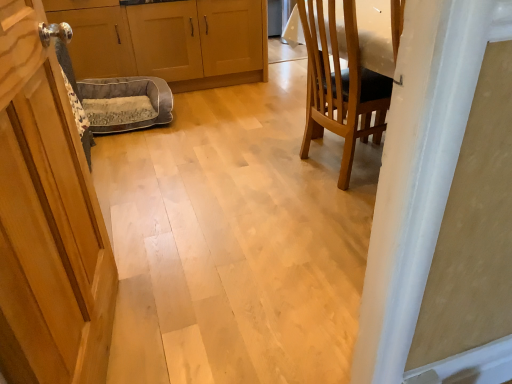
Question: Is gray fabric dog bed at center taller than wooden cabinet at left, the first cabinetry when ordered from left to right?

Choices:
 (A) no
 (B) yes

Answer: (A)

Question: Considering the relative sizes of gray fabric dog bed at center and wooden cabinet at left, the first cabinetry when ordered from left to right, in the image provided, is gray fabric dog bed at center smaller than wooden cabinet at left, the first cabinetry when ordered from left to right,?

Choices:
 (A) no
 (B) yes

Answer: (B)

Question: Considering the relative sizes of gray fabric dog bed at center and wooden cabinet at left, the first cabinetry when ordered from left to right, in the image provided, is gray fabric dog bed at center wider than wooden cabinet at left, the first cabinetry when ordered from left to right,?

Choices:
 (A) no
 (B) yes

Answer: (A)

Question: Is gray fabric dog bed at center shorter than wooden cabinet at left, which appears as the second cabinetry when viewed from the right?

Choices:
 (A) yes
 (B) no

Answer: (A)

Question: Is gray fabric dog bed at center thinner than wooden cabinet at left, which appears as the second cabinetry when viewed from the right?

Choices:
 (A) no
 (B) yes

Answer: (B)

Question: In the image, is gray fabric dog bed at center positioned in front of or behind wooden chair at right?

Choices:
 (A) behind
 (B) front

Answer: (A)

Question: Does point (124, 104) appear closer or farther from the camera than point (322, 115)?

Choices:
 (A) farther
 (B) closer

Answer: (A)

Question: Considering the positions of gray fabric dog bed at center and wooden chair at right in the image, is gray fabric dog bed at center wider or thinner than wooden chair at right?

Choices:
 (A) wide
 (B) thin

Answer: (B)

Question: From a real-world perspective, relative to wooden chair at right, is gray fabric dog bed at center vertically above or below?

Choices:
 (A) below
 (B) above

Answer: (A)

Question: From a real-world perspective, is matte wood cabinets at center, acting as the 2th cabinetry starting from the left, above or below gray fabric dog bed at center?

Choices:
 (A) above
 (B) below

Answer: (A)

Question: From the image's perspective, is matte wood cabinets at center, positioned as the first cabinetry in right-to-left order, positioned above or below gray fabric dog bed at center?

Choices:
 (A) below
 (B) above

Answer: (B)

Question: Considering the positions of matte wood cabinets at center, acting as the 2th cabinetry starting from the left, and gray fabric dog bed at center in the image, is matte wood cabinets at center, acting as the 2th cabinetry starting from the left, wider or thinner than gray fabric dog bed at center?

Choices:
 (A) wide
 (B) thin

Answer: (A)

Question: Considering the positions of matte wood cabinets at center, positioned as the first cabinetry in right-to-left order, and gray fabric dog bed at center in the image, is matte wood cabinets at center, positioned as the first cabinetry in right-to-left order, bigger or smaller than gray fabric dog bed at center?

Choices:
 (A) big
 (B) small

Answer: (A)

Question: Visually, is wooden cabinet at left, the first cabinetry when ordered from left to right, positioned to the left or to the right of gray fabric dog bed at center?

Choices:
 (A) right
 (B) left

Answer: (B)

Question: Considering the positions of wooden cabinet at left, the first cabinetry when ordered from left to right, and gray fabric dog bed at center in the image, is wooden cabinet at left, the first cabinetry when ordered from left to right, taller or shorter than gray fabric dog bed at center?

Choices:
 (A) tall
 (B) short

Answer: (A)